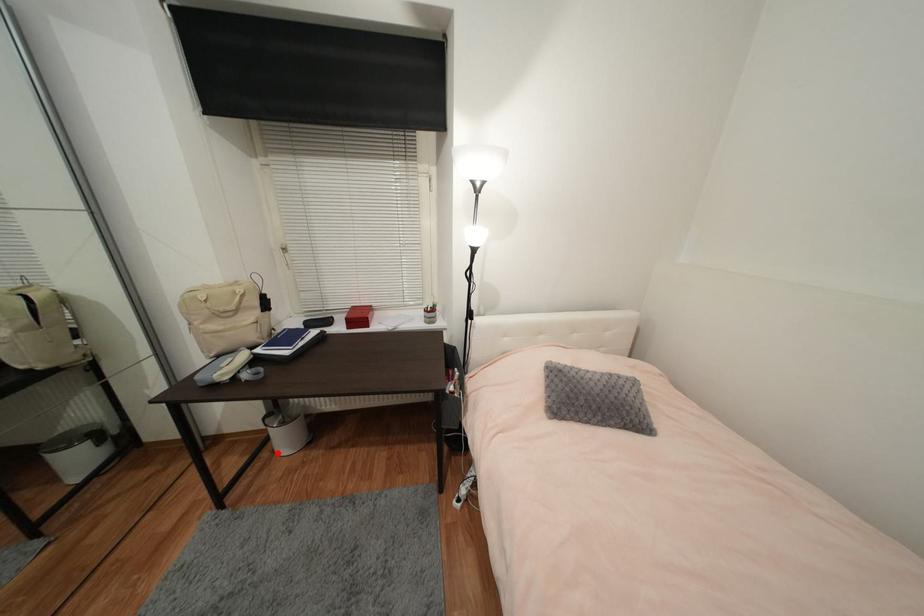
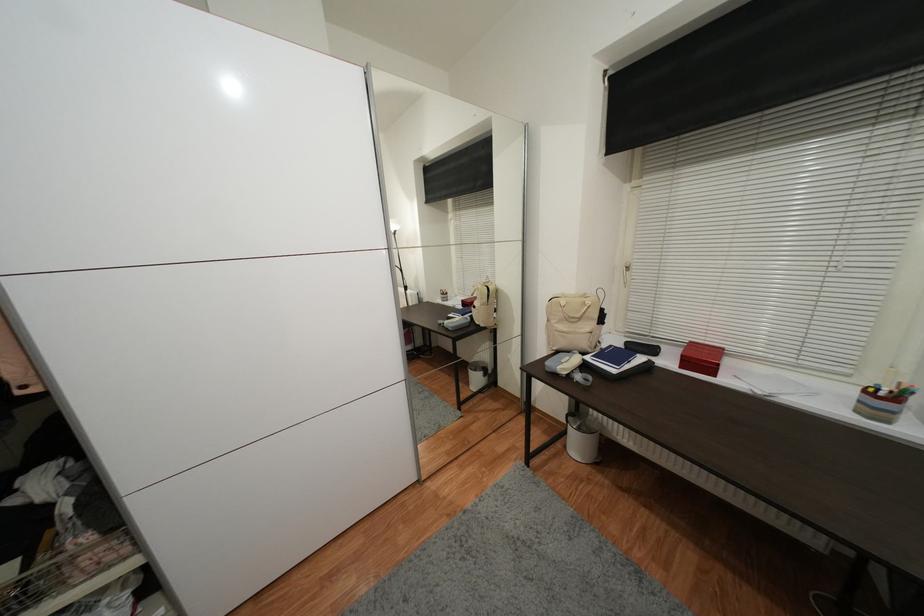
Find the pixel in the second image that matches the highlighted location in the first image.

(569, 448)